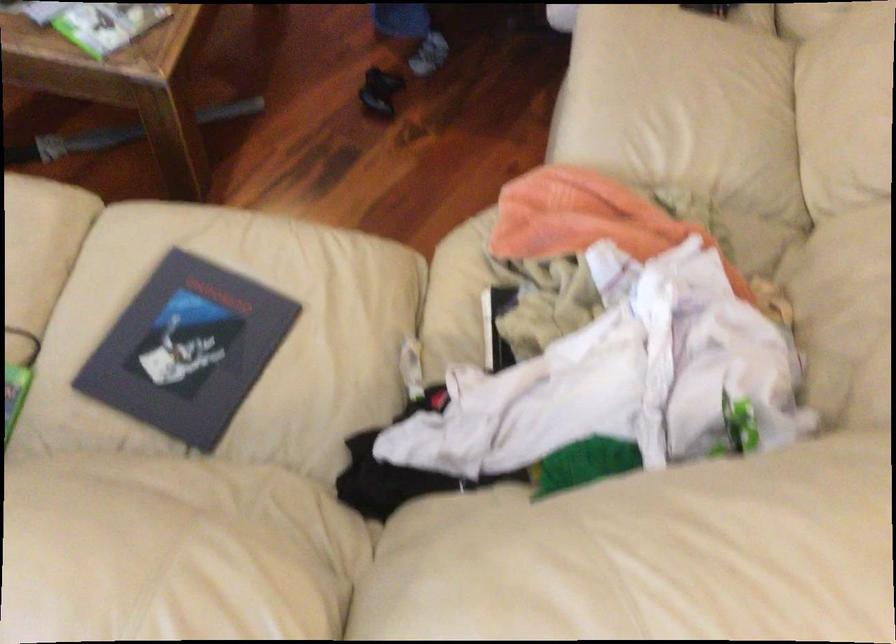
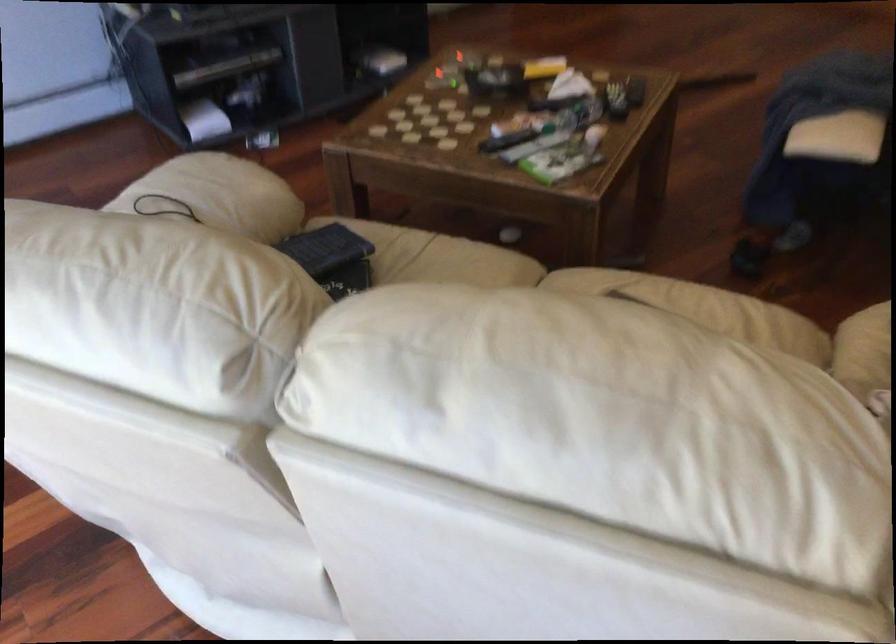
In the second image, find the point that corresponds to [451,297] in the first image.

(864, 351)